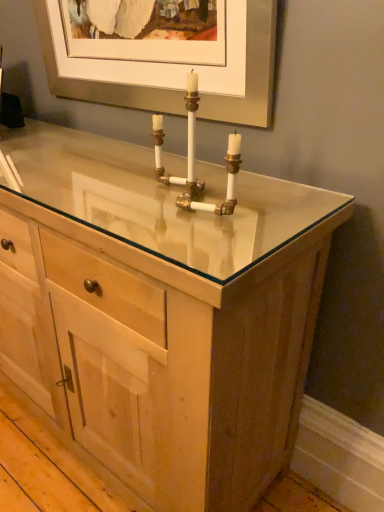
This screenshot has width=384, height=512. What are the coordinates of `vacant space situated above natural wood cabinet at center (from a real-world perspective)` in the screenshot? It's located at (94, 166).